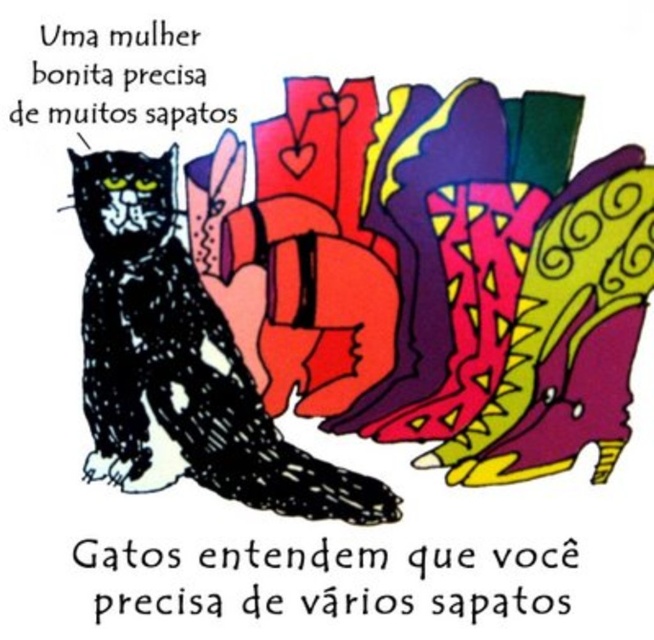
Based on the photo, you are a fashion designer observing the image. You notice two cats on the left side of the image. Which cat is positioned lower between the black textured cat at left and the black glossy cat at left?

The black textured cat at left is positioned lower than the black glossy cat at left.

You are an observer looking at the image. There are two cats labeled as the black textured cat at left and the black glossy cat at left. Which one is positioned more to the right?

The black textured cat at left is positioned more to the right than the black glossy cat at left.